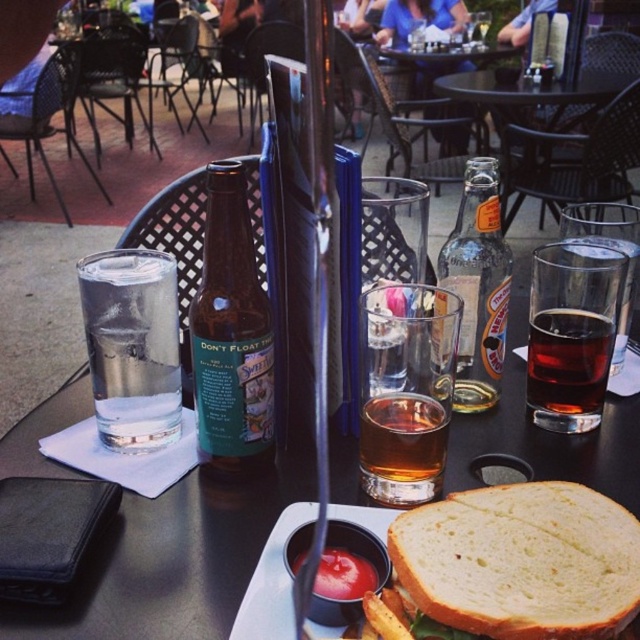
Question: Can you confirm if matte glass water at left is wider than white bread sandwich at center?

Choices:
 (A) no
 (B) yes

Answer: (B)

Question: Which of these objects is positioned closest to the green glass bottle at center?

Choices:
 (A) clear glass bottle at center
 (B) dark amber liquid at sandwich right

Answer: (B)

Question: Which point appears closest to the camera in this image?

Choices:
 (A) (504, 564)
 (B) (84, 300)
 (C) (566, 381)
 (D) (484, 141)

Answer: (A)

Question: Can you confirm if clear glass bottle at center is wider than clear glass bottle at center-right?

Choices:
 (A) no
 (B) yes

Answer: (B)

Question: Is white bread sandwich at center smaller than clear glass water at left?

Choices:
 (A) yes
 (B) no

Answer: (A)

Question: Which object appears farthest from the camera in this image?

Choices:
 (A) dark amber liquid at sandwich right
 (B) white bread sandwich at center
 (C) clear glass bottle at center

Answer: (C)